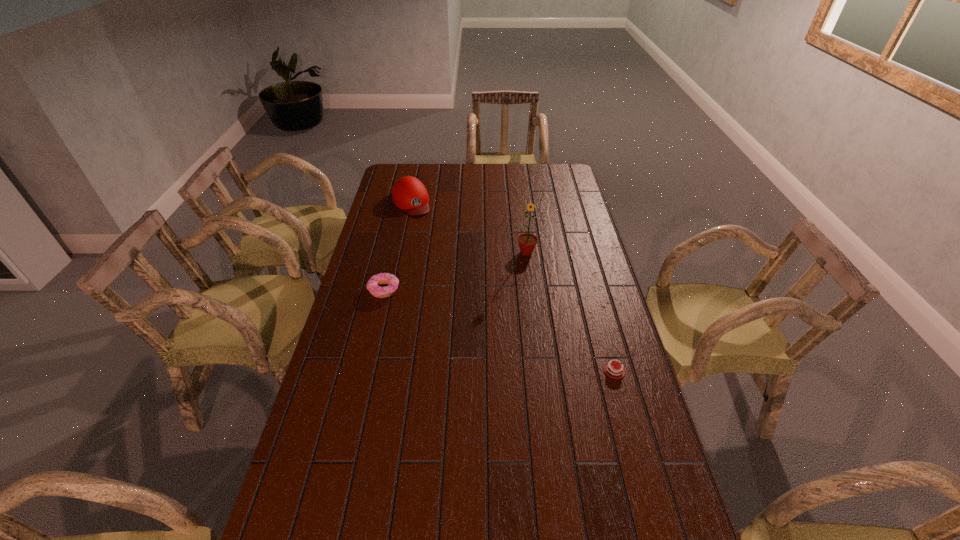
I want to click on free space between the farthest object and the third nearest object, so click(x=468, y=227).

Locate an element on the screen. blank region between the doughnut and the chocolate cake is located at coordinates (499, 330).

The height and width of the screenshot is (540, 960). I want to click on empty space that is in between the third object from left to right and the shortest object, so click(570, 312).

Find the location of a particular element. The height and width of the screenshot is (540, 960). vacant space that is in between the sunflower and the farthest object is located at coordinates (468, 227).

Locate an element on the screen. The width and height of the screenshot is (960, 540). object that ranks as the third closest to the chocolate cake is located at coordinates (409, 194).

Select which object is the third closest to the nearest object. Please provide its 2D coordinates. Your answer should be formatted as a tuple, i.e. [(x, y)], where the tuple contains the x and y coordinates of a point satisfying the conditions above.

[(409, 194)]

Where is `free spot that satisfies the following two spatial constraints: 1. on the front side of the chocolate cake; 2. on the left side of the sunflower`? This screenshot has height=540, width=960. free spot that satisfies the following two spatial constraints: 1. on the front side of the chocolate cake; 2. on the left side of the sunflower is located at coordinates (541, 370).

Find the location of a particular element. vacant area in the image that satisfies the following two spatial constraints: 1. on the front side of the third tallest object; 2. on the right side of the nearest object is located at coordinates (365, 370).